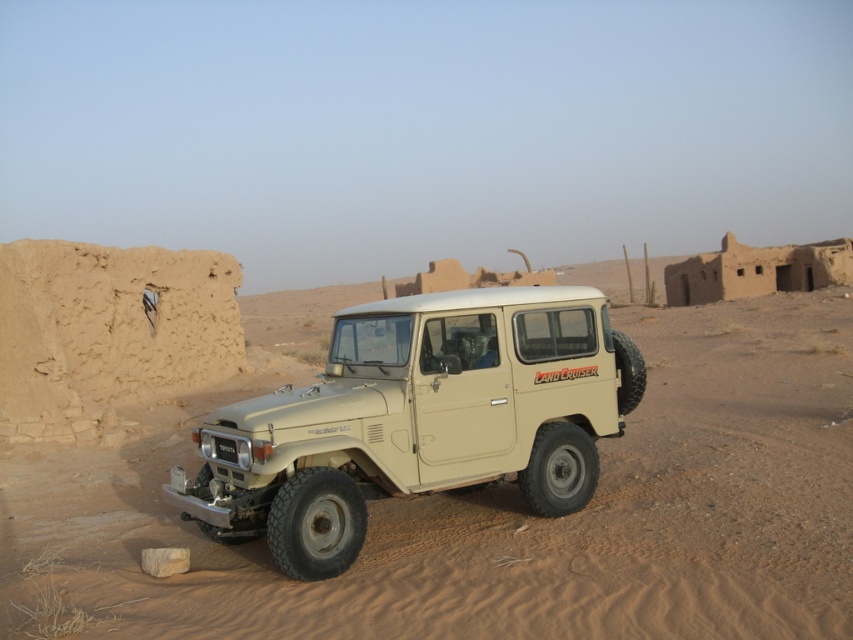
You are a driver trying to park your beige matte Landcruiser at center in a desert area. There is beige sand at center where you want to park. How much space do you need between the vehicle and the sand to park safely?

The beige sand at center and beige matte landcruiser at center are 3.53 meters apart from each other, so you need at least 3.53 meters of space to park safely.

You are standing in the desert and see the beige sand at center and the beige matte landcruiser at center. Which object is closer to you?

The beige sand at center is closer to the viewer than the beige matte landcruiser at center.

Consider the image. You are a photographer planning to capture the beige matte landcruiser at center against the beige sand at center. Considering the height difference between them, which object will appear larger in the photo if you focus on the taller one?

The beige sand at center is taller than the beige matte landcruiser at center, so focusing on the taller object would make the beige sand at center appear larger in the photo.